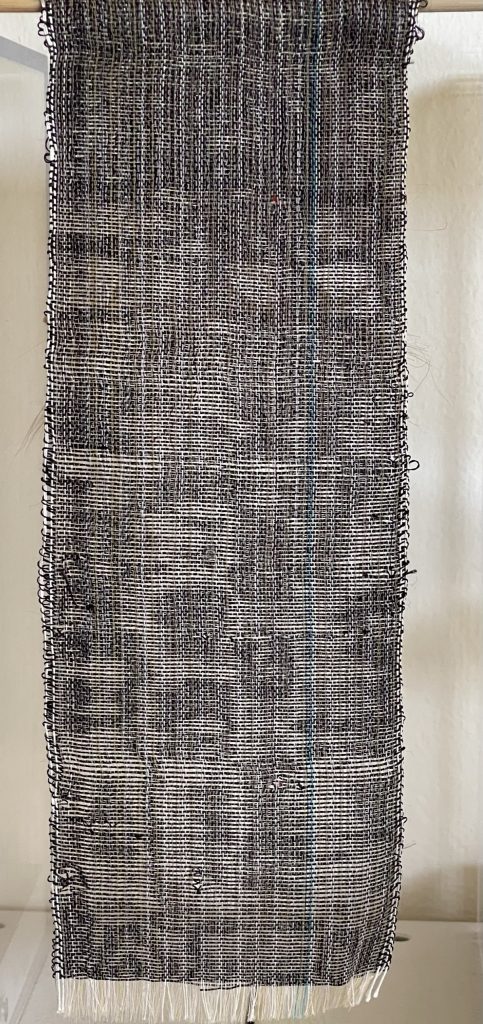
Where is `texture on back wall`? Image resolution: width=483 pixels, height=1024 pixels. texture on back wall is located at coordinates coord(440,20), coord(22,29).